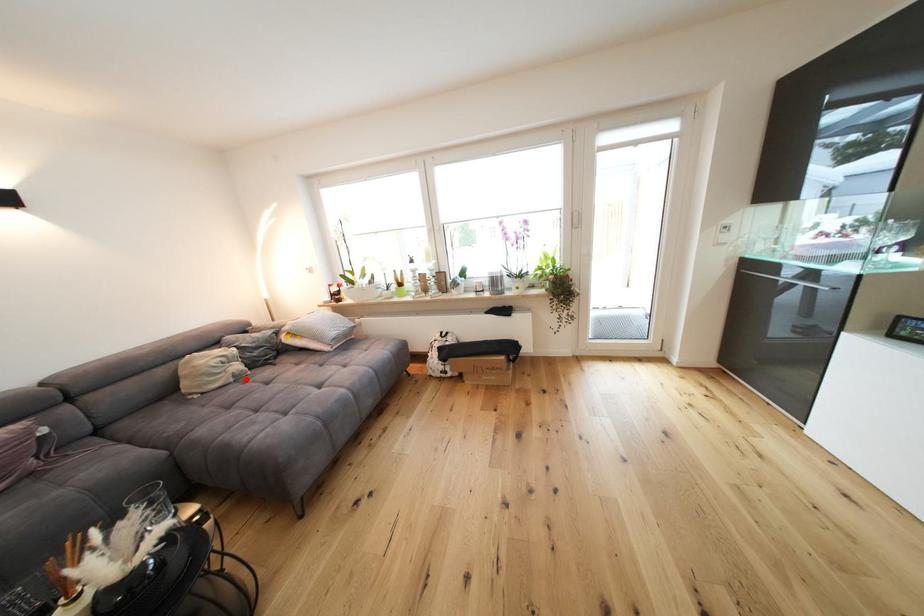
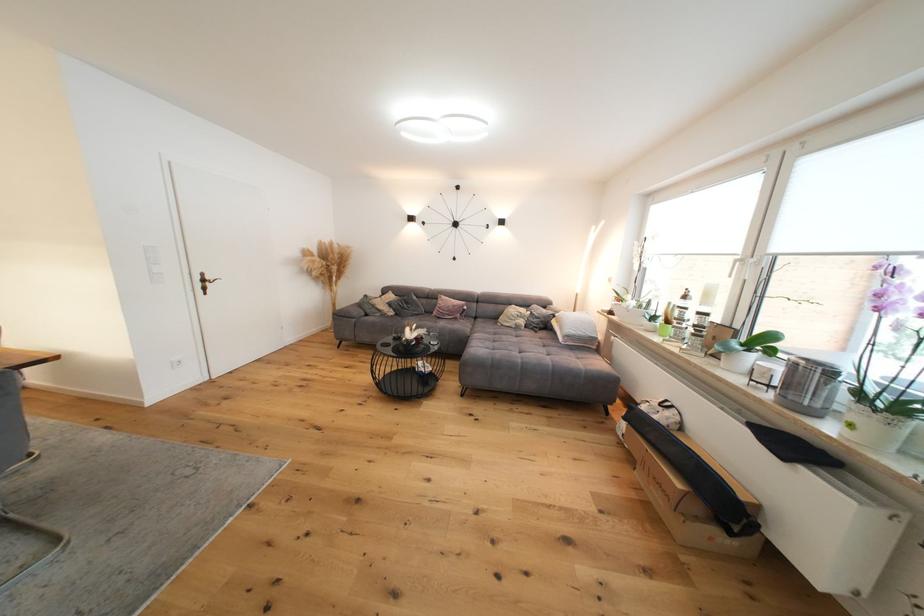
Find the pixel in the second image that matches the highlighted location in the first image.

(524, 330)